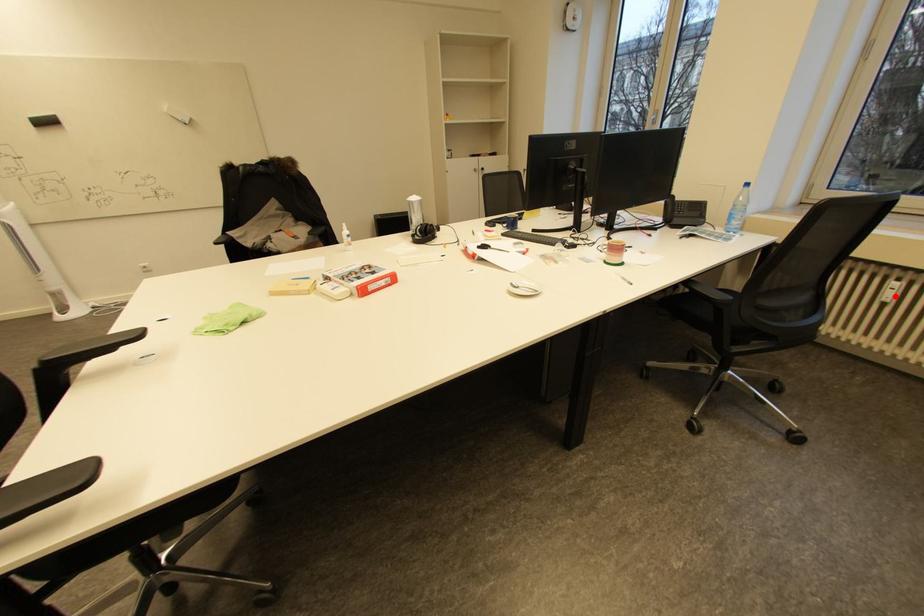
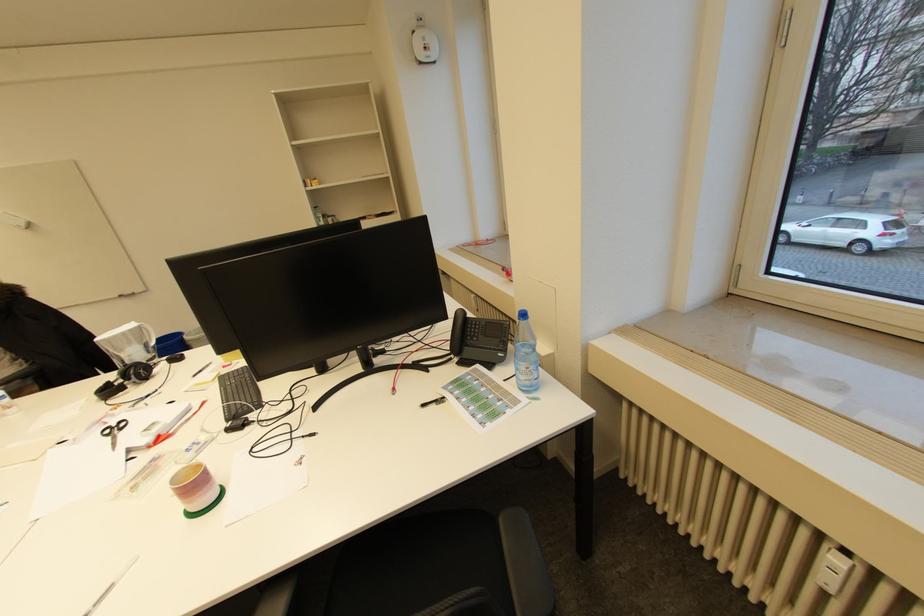
Question: I am providing you with two images of the same scene from different viewpoints. Given a red point in image1, look at the same physical point in image2. Is it:

Choices:
 (A) Closer to the viewpoint
 (B) Farther from the viewpoint

Answer: (A)